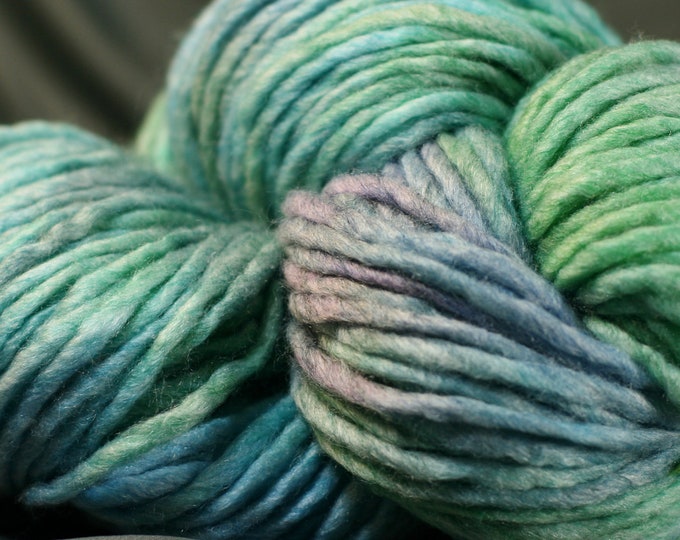
Image resolution: width=680 pixels, height=540 pixels. In order to click on olive green fabric background in this screenshot , I will do `click(92, 26)`.